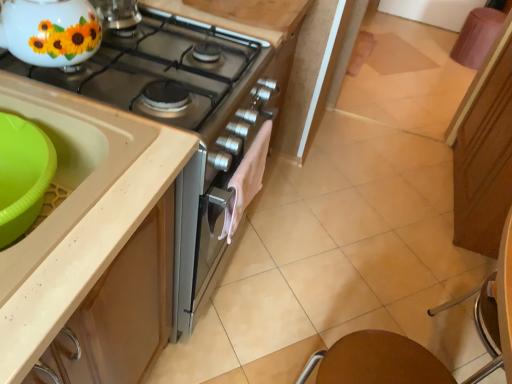
Question: Does beige plastic sink at left, which is the 2th sink from back to front, have a smaller size compared to white glossy teapot at upper left?

Choices:
 (A) no
 (B) yes

Answer: (A)

Question: Does beige plastic sink at left, the first sink positioned from the front, have a lesser width compared to white glossy teapot at upper left?

Choices:
 (A) no
 (B) yes

Answer: (A)

Question: Is beige plastic sink at left, the first sink positioned from the front, to the left of white glossy teapot at upper left from the viewer's perspective?

Choices:
 (A) no
 (B) yes

Answer: (B)

Question: From the image's perspective, is beige plastic sink at left, the first sink positioned from the front, over white glossy teapot at upper left?

Choices:
 (A) no
 (B) yes

Answer: (A)

Question: Is beige plastic sink at left, the first sink positioned from the front, directly adjacent to white glossy teapot at upper left?

Choices:
 (A) no
 (B) yes

Answer: (A)

Question: Can you confirm if beige plastic sink at left, which is the 2th sink from back to front, is wider than white glossy teapot at upper left?

Choices:
 (A) yes
 (B) no

Answer: (A)

Question: Is brown matte table at lower right smaller than metallic silver gas stove at upper left?

Choices:
 (A) yes
 (B) no

Answer: (A)

Question: Considering the relative positions of brown matte table at lower right and metallic silver gas stove at upper left in the image provided, is brown matte table at lower right to the left of metallic silver gas stove at upper left from the viewer's perspective?

Choices:
 (A) no
 (B) yes

Answer: (A)

Question: From a real-world perspective, is brown matte table at lower right under metallic silver gas stove at upper left?

Choices:
 (A) yes
 (B) no

Answer: (A)

Question: Is metallic silver gas stove at upper left inside brown matte table at lower right?

Choices:
 (A) yes
 (B) no

Answer: (B)

Question: Are brown matte table at lower right and metallic silver gas stove at upper left making contact?

Choices:
 (A) no
 (B) yes

Answer: (A)

Question: Is brown matte table at lower right positioned in front of metallic silver gas stove at upper left?

Choices:
 (A) no
 (B) yes

Answer: (A)

Question: Considering the relative sizes of metallic silver chair at lower right and white glossy teapot at upper left in the image provided, is metallic silver chair at lower right bigger than white glossy teapot at upper left?

Choices:
 (A) yes
 (B) no

Answer: (A)